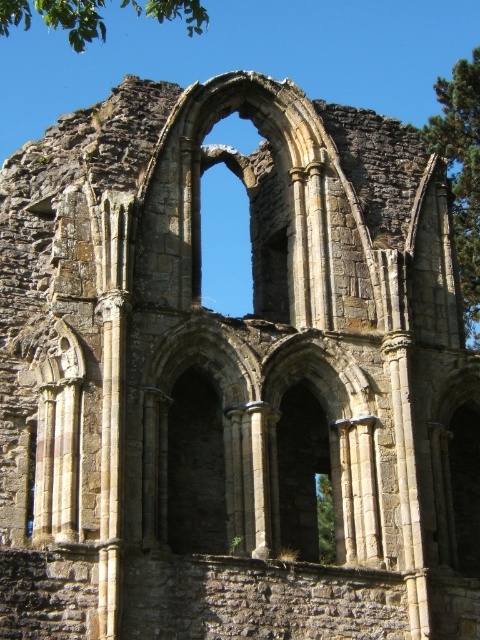
You are standing in front of the ancient stone structure and notice two green leafy trees in the upper part of the image. Which tree is closer to you, the green leafy tree at upper right or the green leafy tree at upper left?

The green leafy tree at upper right is closer to you because it is further to the viewer than the green leafy tree at upper left.